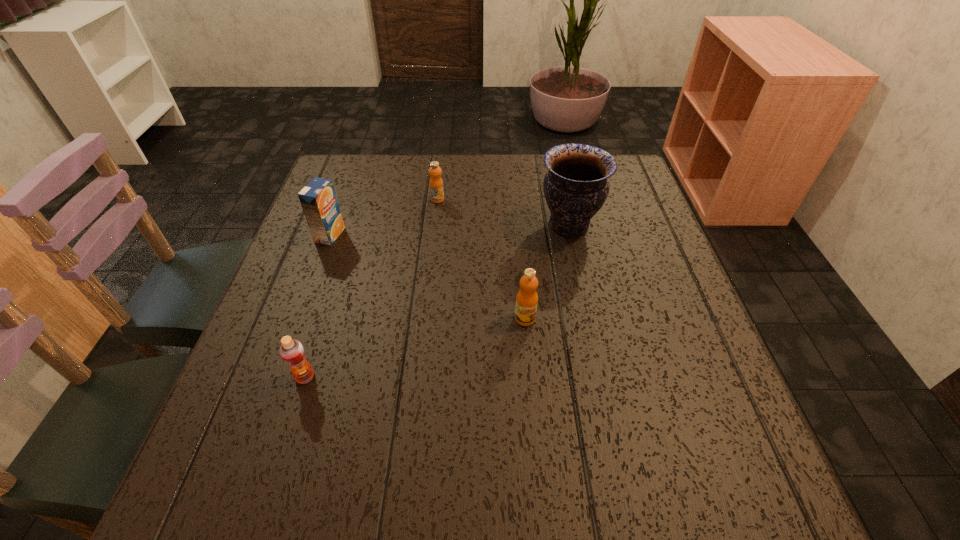
In order to click on vacant region at the right edge in this screenshot , I will do `click(677, 422)`.

Locate an element on the screen. Image resolution: width=960 pixels, height=540 pixels. vacant space at the far left corner of the desktop is located at coordinates (364, 177).

The height and width of the screenshot is (540, 960). In order to click on vacant space at the near left corner of the desktop in this screenshot , I will do `click(280, 469)`.

This screenshot has width=960, height=540. In the image, there is a desktop. Identify the location of free space at the far right corner. (616, 193).

The image size is (960, 540). What are the coordinates of `vacant point located between the fourth object from left to right and the tallest object` in the screenshot? It's located at 547,272.

Locate an element on the screen. The image size is (960, 540). free space between the third nearest orange juice and the farthest orange juice is located at coordinates (384, 218).

You are a GUI agent. You are given a task and a screenshot of the screen. Output one action in this format:
    pyautogui.click(x=<x>, y=<y>)
    Task: Click on the vacant area that lies between the third object from left to right and the second farthest orange juice
    This screenshot has width=960, height=540.
    Given the screenshot: What is the action you would take?
    pyautogui.click(x=384, y=218)

In order to click on empty location between the second farthest orange juice and the tallest object in this screenshot , I will do `click(449, 230)`.

The height and width of the screenshot is (540, 960). I want to click on free space between the nearest object and the second farthest orange juice, so point(318,306).

This screenshot has height=540, width=960. I want to click on empty location between the second farthest orange juice and the farthest orange juice, so click(x=384, y=218).